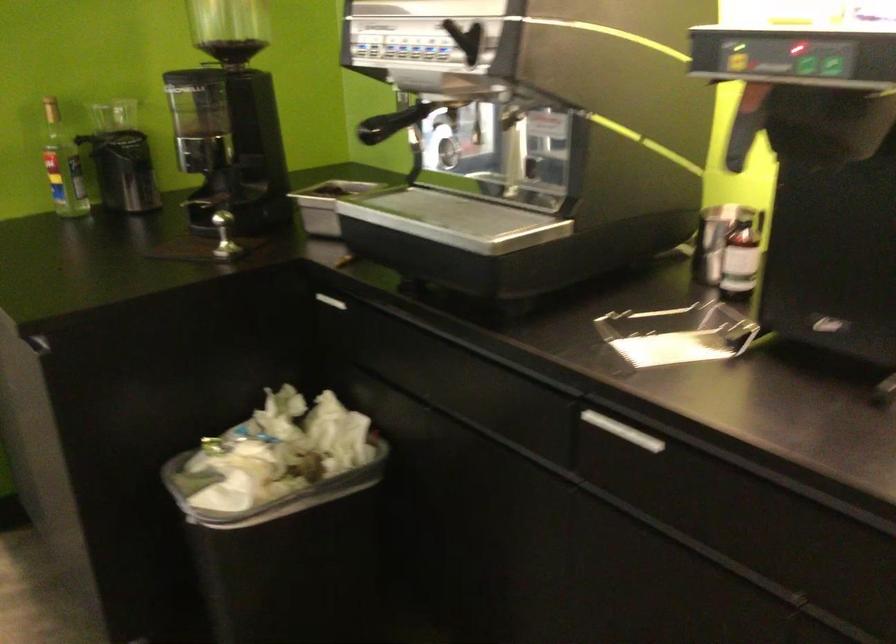
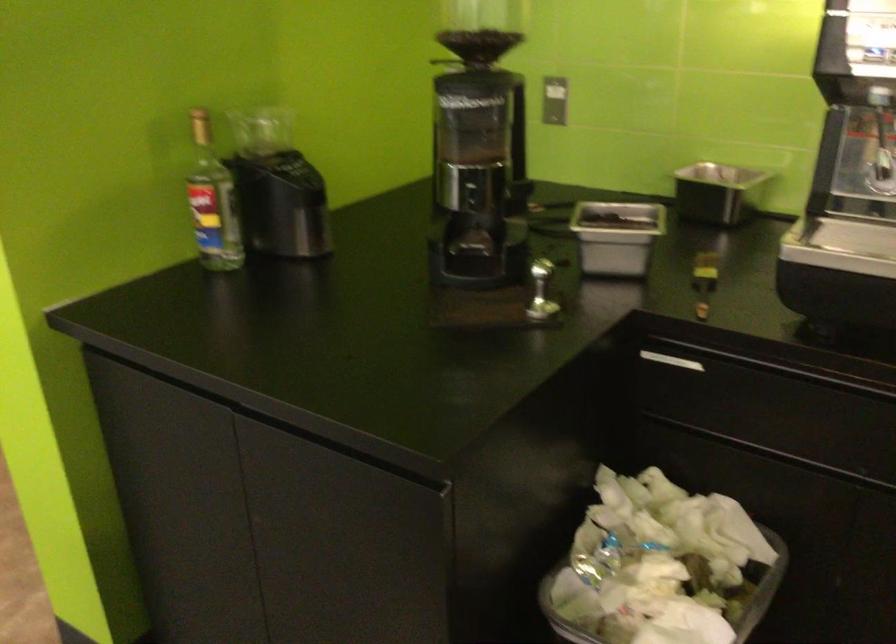
Question: The camera is either moving clockwise (left) or counter-clockwise (right) around the object. The first image is from the beginning of the video and the second image is from the end. Is the camera moving left or right when shooting the video?

Choices:
 (A) Left
 (B) Right

Answer: (A)